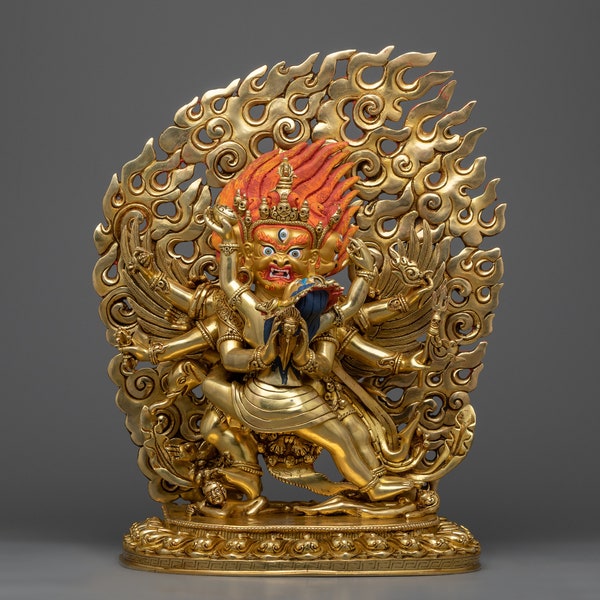
Where is `statue base`? The width and height of the screenshot is (600, 600). statue base is located at coordinates (302, 572).